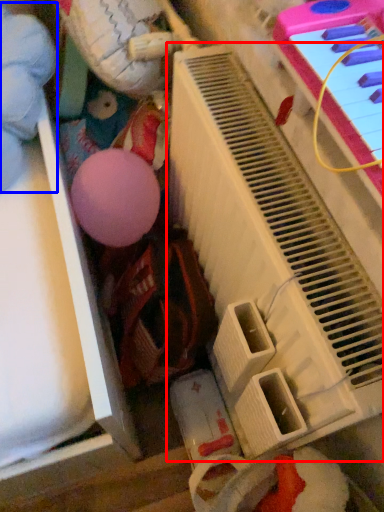
Question: Which object is further to the camera taking this photo, piano (highlighted by a red box) or toy (highlighted by a blue box)?

Choices:
 (A) piano
 (B) toy

Answer: (B)